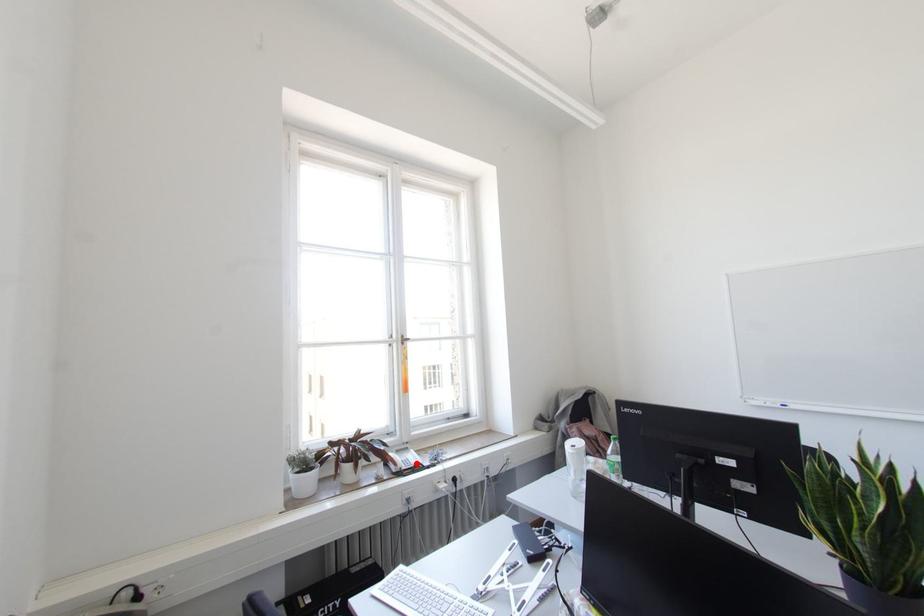
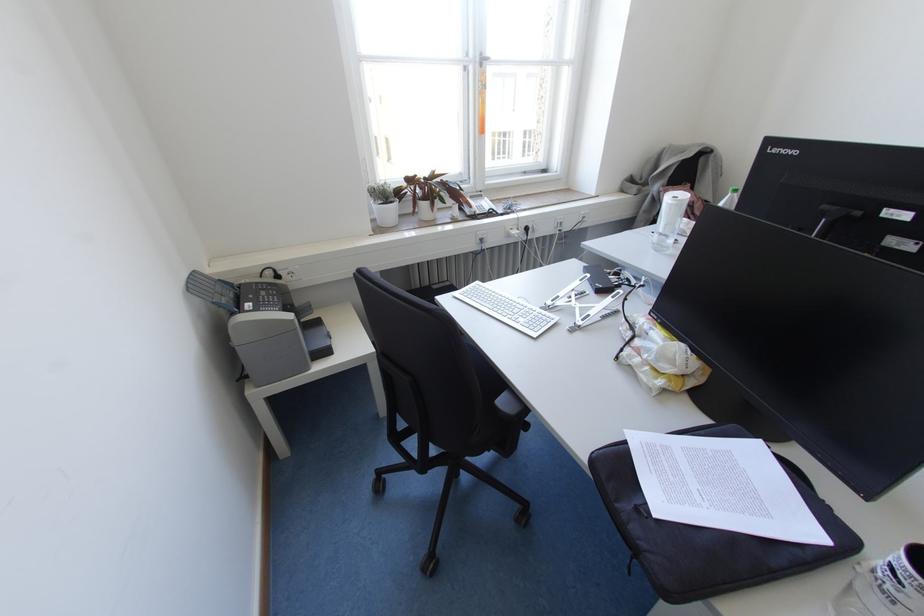
Question: I am providing you with two images of the same scene from different viewpoints. A red point is marked on the first image. Is the red point's position out of view in image 2?

Choices:
 (A) Yes
 (B) No

Answer: (B)